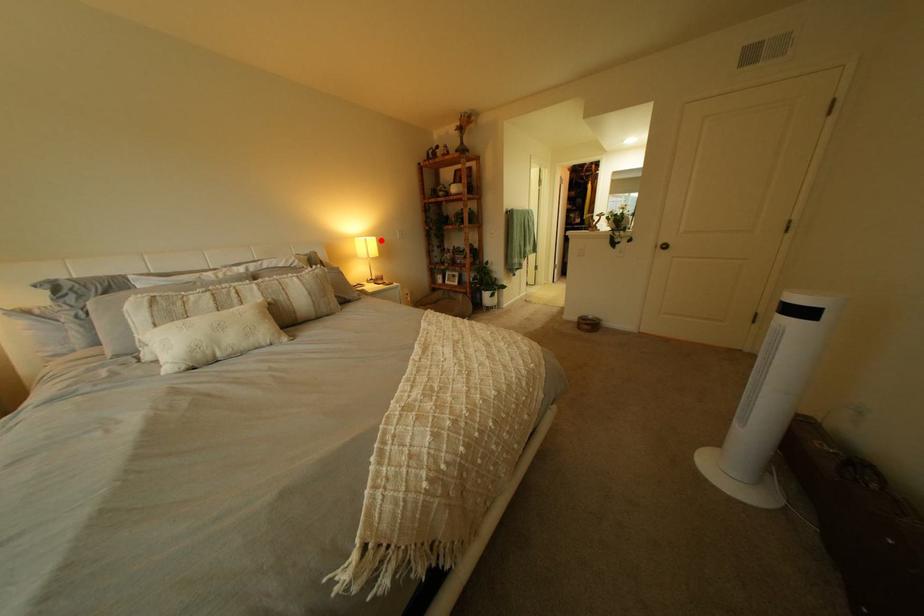
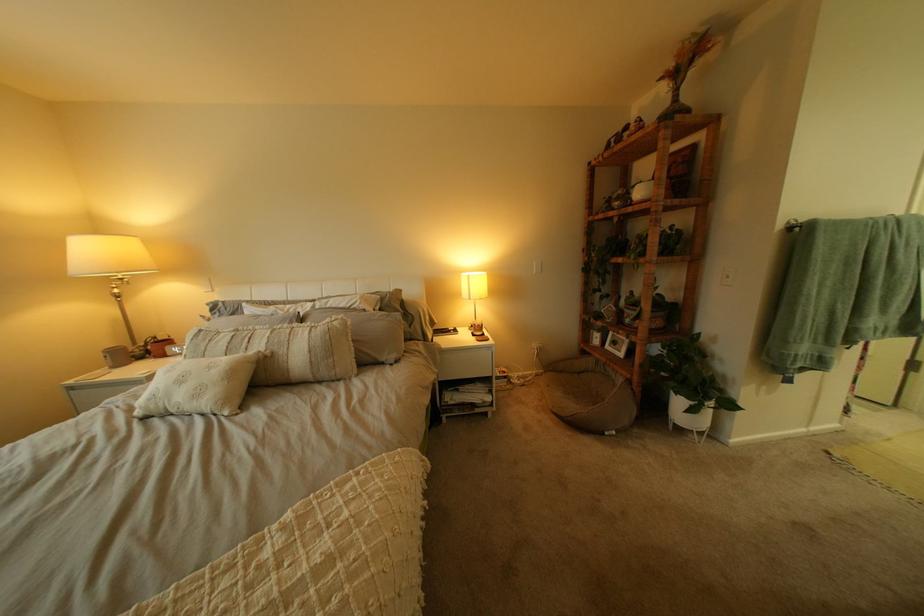
Question: I am providing you with two images of the same scene from different viewpoints. Image1 has a red point marked. In image2, the corresponding 3D location appears at what relative position? Reply with the corresponding letter.

Choices:
 (A) Closer
 (B) Farther

Answer: (B)